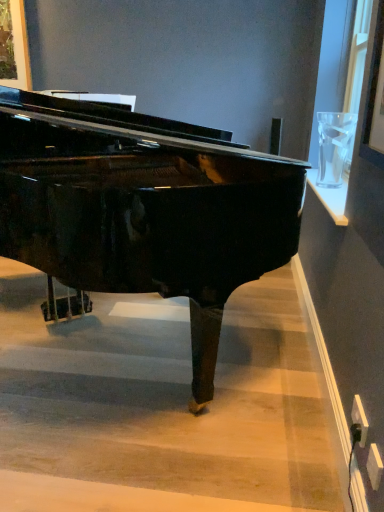
In order to click on wooden stairwell at center in this screenshot , I will do `click(161, 405)`.

Image resolution: width=384 pixels, height=512 pixels. Describe the element at coordinates (161, 405) in the screenshot. I see `wooden stairwell at center` at that location.

What is the approximate height of wooden stairwell at center?

It is 9.30 centimeters.

Image resolution: width=384 pixels, height=512 pixels. Describe the element at coordinates (144, 208) in the screenshot. I see `glossy black piano at center` at that location.

Locate an element on the screen. glossy black piano at center is located at coordinates (144, 208).

In order to face glossy black piano at center, should I rotate leftwards or rightwards?

Turn left by 11.322 degrees to look at glossy black piano at center.

Image resolution: width=384 pixels, height=512 pixels. What are the coordinates of `wooden stairwell at center` in the screenshot? It's located at (161, 405).

Is wooden stairwell at center to the left or to the right of glossy black piano at center in the image?

In the image, wooden stairwell at center appears on the right side of glossy black piano at center.

From the picture: Which object is more forward, wooden stairwell at center or glossy black piano at center?

glossy black piano at center is closer to the camera.

Which is behind, point (79, 412) or point (209, 283)?

Point (79, 412)

From the image's perspective, which one is positioned lower, wooden stairwell at center or glossy black piano at center?

wooden stairwell at center appears lower in the image.

From a real-world perspective, is wooden stairwell at center beneath glossy black piano at center?

Yes, from a real-world perspective, wooden stairwell at center is below glossy black piano at center.

Considering the sizes of wooden stairwell at center and glossy black piano at center in the image, is wooden stairwell at center wider or thinner than glossy black piano at center?

Considering their sizes, wooden stairwell at center looks broader than glossy black piano at center.

In terms of height, does wooden stairwell at center look taller or shorter compared to glossy black piano at center?

In the image, wooden stairwell at center appears to be shorter than glossy black piano at center.

Which of these two, wooden stairwell at center or glossy black piano at center, is bigger?

glossy black piano at center.

Is wooden stairwell at center not within glossy black piano at center?

wooden stairwell at center lies outside glossy black piano at center's area.

Is wooden stairwell at center not near glossy black piano at center?

Actually, wooden stairwell at center and glossy black piano at center are a little close together.

Based on the photo, is wooden stairwell at center positioned with its back to glossy black piano at center?

No, wooden stairwell at center is not facing the opposite direction of glossy black piano at center.

Where is `stairwell on the right of glossy black piano at center`? The height and width of the screenshot is (512, 384). stairwell on the right of glossy black piano at center is located at coordinates (161, 405).

Between glossy black piano at center and wooden stairwell at center, which one appears on the right side from the viewer's perspective?

wooden stairwell at center.

Does glossy black piano at center lie in front of wooden stairwell at center?

Yes.

Is point (66, 201) positioned after point (50, 408)?

Yes, point (66, 201) is farther from viewer.

From the image's perspective, is glossy black piano at center located above or below wooden stairwell at center?

Clearly, from the image's perspective, glossy black piano at center is above wooden stairwell at center.

From a real-world perspective, between glossy black piano at center and wooden stairwell at center, who is vertically higher?

glossy black piano at center is physically above.

Considering the relative sizes of glossy black piano at center and wooden stairwell at center in the image provided, is glossy black piano at center thinner than wooden stairwell at center?

Yes, glossy black piano at center is thinner than wooden stairwell at center.

Considering the relative sizes of glossy black piano at center and wooden stairwell at center in the image provided, is glossy black piano at center taller than wooden stairwell at center?

Yes.

Which of these two, glossy black piano at center or wooden stairwell at center, is bigger?

glossy black piano at center.

In the scene shown: Is wooden stairwell at center inside glossy black piano at center?

Definitely not — wooden stairwell at center is not inside glossy black piano at center.

In the scene shown: Is glossy black piano at center not near wooden stairwell at center?

glossy black piano at center is actually quite close to wooden stairwell at center.

Is glossy black piano at center positioned with its back to wooden stairwell at center?

No, glossy black piano at center is not facing away from wooden stairwell at center.

How many degrees apart are the facing directions of glossy black piano at center and wooden stairwell at center?

glossy black piano at center and wooden stairwell at center are facing 36.5 degrees away from each other.

I want to click on stairwell behind the glossy black piano at center, so click(x=161, y=405).

Find the location of a particular element. piano above the wooden stairwell at center (from the image's perspective) is located at coordinates (144, 208).

The image size is (384, 512). Identify the location of stairwell behind the glossy black piano at center. (161, 405).